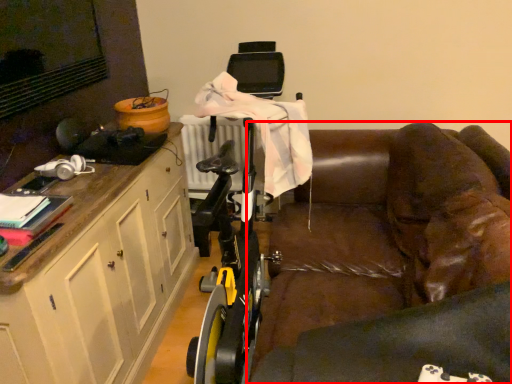
Question: From the image, what is the correct spatial relationship of studio couch (annotated by the red box) in relation to cabinetry?

Choices:
 (A) right
 (B) left

Answer: (A)